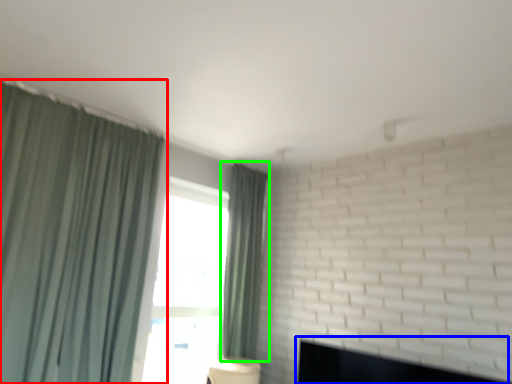
Question: Which is farther away from curtain (highlighted by a red box)? fireplace (highlighted by a blue box) or curtain (highlighted by a green box)?

Choices:
 (A) fireplace
 (B) curtain

Answer: (A)